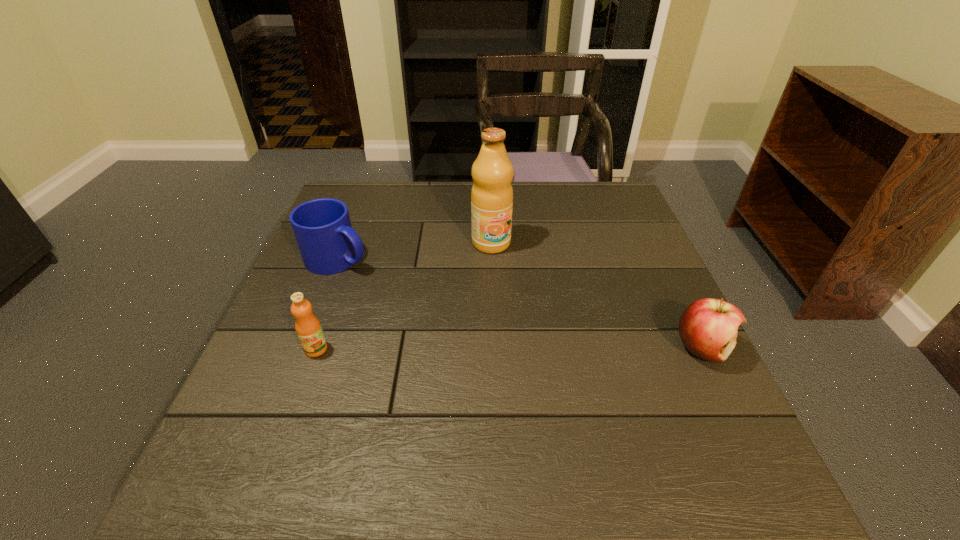
This screenshot has height=540, width=960. Identify the location of free spot between the rightmost object and the mug. (520, 303).

I want to click on object that is the third closest one to the rightmost object, so click(x=308, y=328).

Locate which object is the closest to the orange juice. Please provide its 2D coordinates. Your answer should be formatted as a tuple, i.e. [(x, y)], where the tuple contains the x and y coordinates of a point satisfying the conditions above.

[(328, 244)]

Locate an element on the screen. The height and width of the screenshot is (540, 960). free space that satisfies the following two spatial constraints: 1. on the back side of the second object from right to left; 2. on the right side of the mug is located at coordinates coord(345,243).